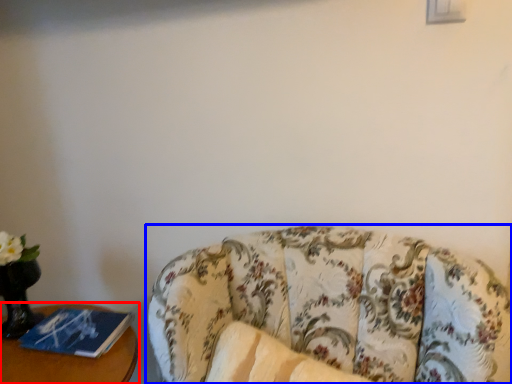
Question: Which point is closer to the camera, furniture (highlighted by a red box) or studio couch (highlighted by a blue box)?

Choices:
 (A) furniture
 (B) studio couch

Answer: (B)